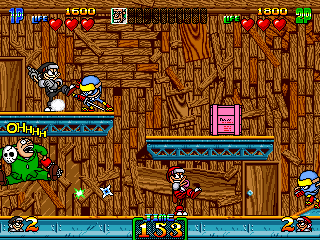
Locate an element on the screen. This screenshot has height=240, width=320. doorknobs is located at coordinates (251, 191).